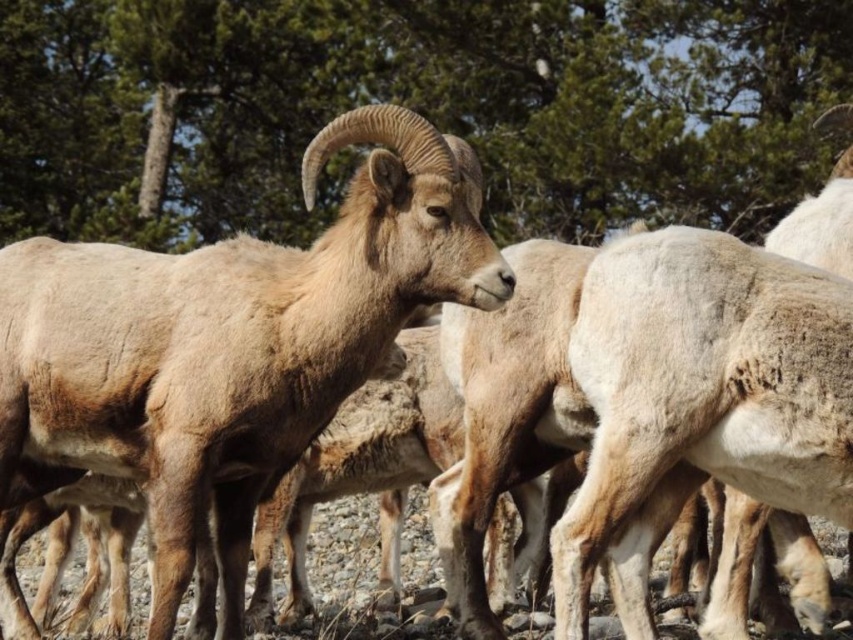
You are a hiker who wants to take a photo of the brown woolen goat at center and the green leafy tree at upper center. Which object is wider in the image?

The green leafy tree at upper center is wider than the brown woolen goat at center.